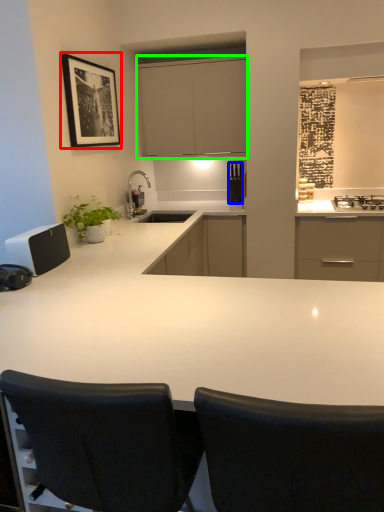
Question: Which is farther away from picture frame (highlighted by a red box)? appliance (highlighted by a blue box) or cabinetry (highlighted by a green box)?

Choices:
 (A) appliance
 (B) cabinetry

Answer: (A)